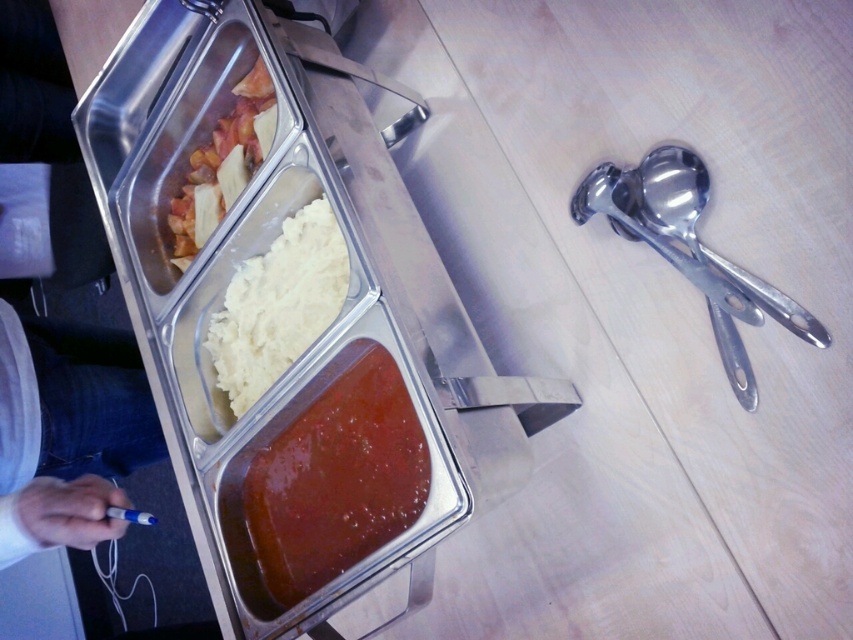
Question: Does shiny red sauce at center have a smaller size compared to white creamy mashed potato at center?

Choices:
 (A) no
 (B) yes

Answer: (A)

Question: Is shiny red sauce at center wider than matte plastic pasta at upper left?

Choices:
 (A) yes
 (B) no

Answer: (A)

Question: Based on their relative distances, which object is farther from the shiny metallic spoon at right?

Choices:
 (A) satin silver spoon at right
 (B) matte plastic pasta at upper left

Answer: (B)

Question: Based on their relative distances, which object is farther from the matte plastic pasta at upper left?

Choices:
 (A) shiny metallic spoon at right
 (B) white creamy mashed potato at center
 (C) shiny red sauce at center

Answer: (A)

Question: Which of the following is the closest to the observer?

Choices:
 (A) shiny red sauce at center
 (B) satin silver spoon at right

Answer: (B)

Question: Is shiny red sauce at center thinner than shiny metallic spoon at right?

Choices:
 (A) no
 (B) yes

Answer: (A)